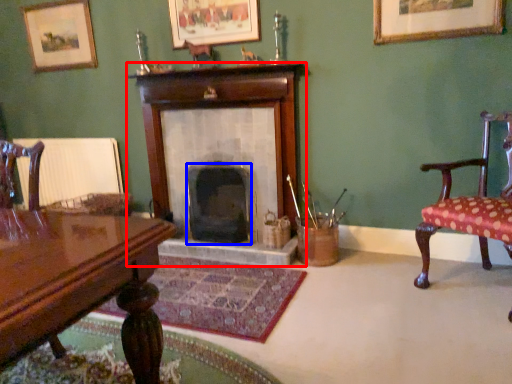
Question: Which point is closer to the camera, fireplace (highlighted by a red box) or fireplace (highlighted by a blue box)?

Choices:
 (A) fireplace
 (B) fireplace

Answer: (A)